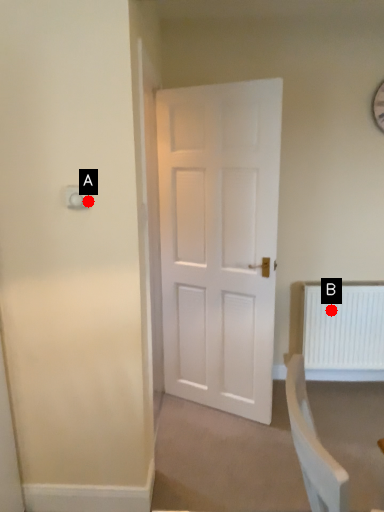
Question: Two points are circled on the image, labeled by A and B beside each circle. Among these points, which one is nearest to the camera?

Choices:
 (A) A is closer
 (B) B is closer

Answer: (A)